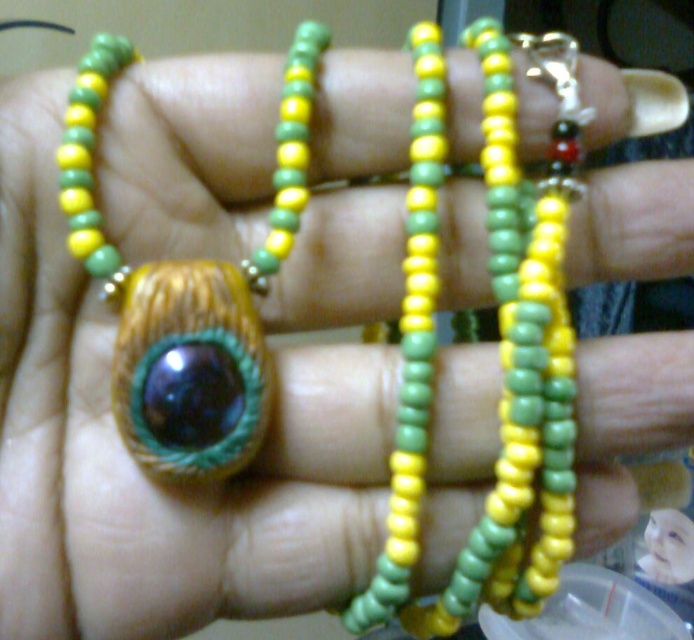
Question: In this image, where is matte plastic face at center located relative to matte brown eye at center?

Choices:
 (A) left
 (B) right

Answer: (A)

Question: Does matte plastic face at center appear on the left side of matte brown eye at center?

Choices:
 (A) no
 (B) yes

Answer: (B)

Question: Does matte plastic face at center have a larger size compared to matte brown eye at center?

Choices:
 (A) no
 (B) yes

Answer: (B)

Question: Which of the following is the closest to the observer?

Choices:
 (A) matte plastic face at center
 (B) matte brown eye at center

Answer: (A)

Question: Which object appears farthest from the camera in this image?

Choices:
 (A) matte plastic face at center
 (B) matte brown eye at center

Answer: (B)